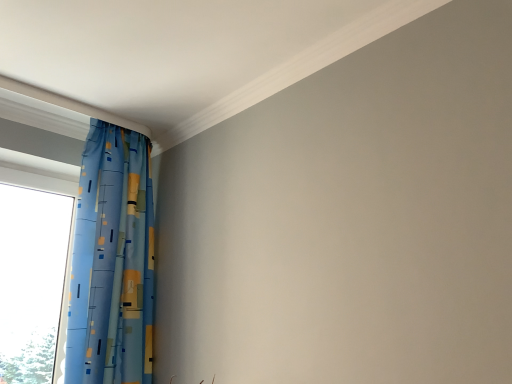
Question: From the image's perspective, is transparent glass window at left positioned above or below blue printed fabric curtain at left?

Choices:
 (A) below
 (B) above

Answer: (A)

Question: Looking at their shapes, would you say transparent glass window at left is wider or thinner than blue printed fabric curtain at left?

Choices:
 (A) thin
 (B) wide

Answer: (A)

Question: Is transparent glass window at left in front of or behind blue printed fabric curtain at left in the image?

Choices:
 (A) behind
 (B) front

Answer: (A)

Question: Considering the relative positions of blue printed fabric curtain at left and transparent glass window at left in the image provided, is blue printed fabric curtain at left to the left or to the right of transparent glass window at left?

Choices:
 (A) right
 (B) left

Answer: (A)

Question: Is point (138, 291) closer or farther from the camera than point (16, 249)?

Choices:
 (A) farther
 (B) closer

Answer: (B)

Question: Looking at the image, does blue printed fabric curtain at left seem bigger or smaller compared to transparent glass window at left?

Choices:
 (A) small
 (B) big

Answer: (B)

Question: Would you say blue printed fabric curtain at left is inside or outside transparent glass window at left?

Choices:
 (A) inside
 (B) outside

Answer: (B)